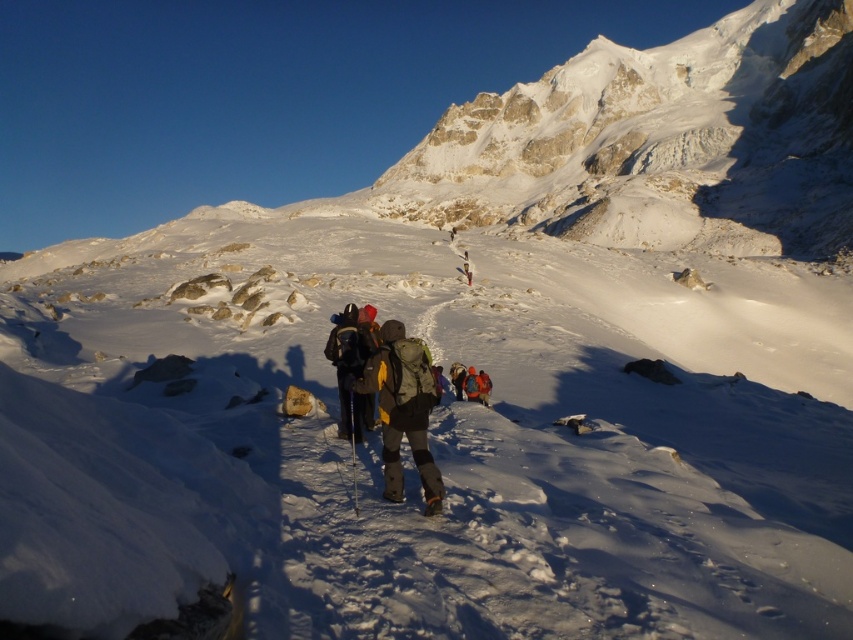
You are a hiker planning to place a marker at point (403, 410) on the map. What object is at that coordinate?

The matte gray jacket at center is located at point (403, 410).

You are a hiker trying to locate your belongings. You remember your matte gray jacket at center is to the right of your matte black backpack at center. If you turn to face the direction of the sun, which item would be on your left?

Since the matte gray jacket at center is to the right of the matte black backpack at center and the sun is casting long shadows, indicating it is either early morning or late afternoon. Assuming the sun is in the east during early morning or west during late afternoon, if you face the sun, your shadow would be behind you. However, the spatial relationship between the jacket and backpack remains consistent. Therefore, if the matte gray jacket at center is to the right of the matte black backpack at center, 1

You are a hiker trying to determine if your matte gray jacket at center will fit into your matte black backpack at center for storage. Based on their sizes, can you confirm if the jacket can fit inside the backpack?

The matte gray jacket at center might be wider than matte black backpack at center, so there is a possibility that the jacket may not fit inside the backpack due to its width.